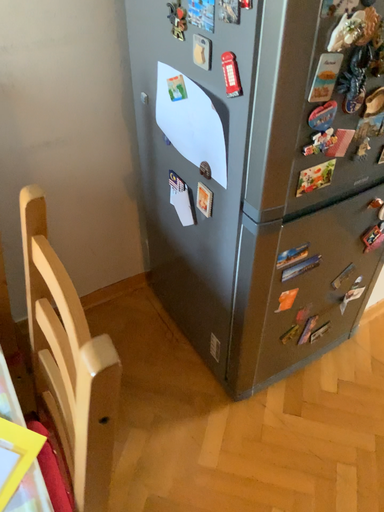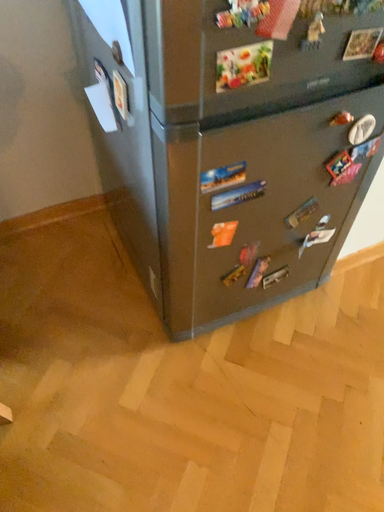
Question: Which way did the camera rotate in the video?

Choices:
 (A) rotated downward
 (B) rotated upward

Answer: (A)